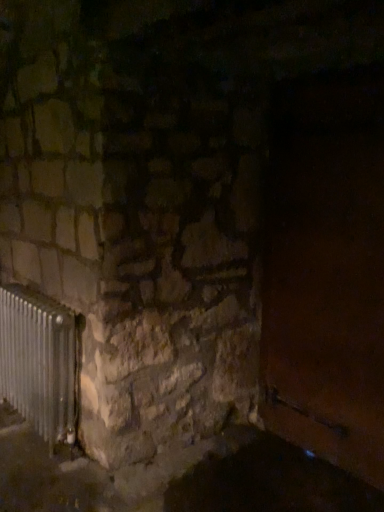
What do you see at coordinates (38, 362) in the screenshot?
I see `silver metallic radiator at lower left` at bounding box center [38, 362].

The width and height of the screenshot is (384, 512). I want to click on silver metallic radiator at lower left, so click(x=38, y=362).

Consider the image. What is the approximate width of silver metallic radiator at lower left?

silver metallic radiator at lower left is 20.16 centimeters wide.

Measure the distance between silver metallic radiator at lower left and camera.

The distance of silver metallic radiator at lower left from camera is 2.14 meters.

Where is `silver metallic radiator at lower left`? This screenshot has width=384, height=512. silver metallic radiator at lower left is located at coordinates (38, 362).